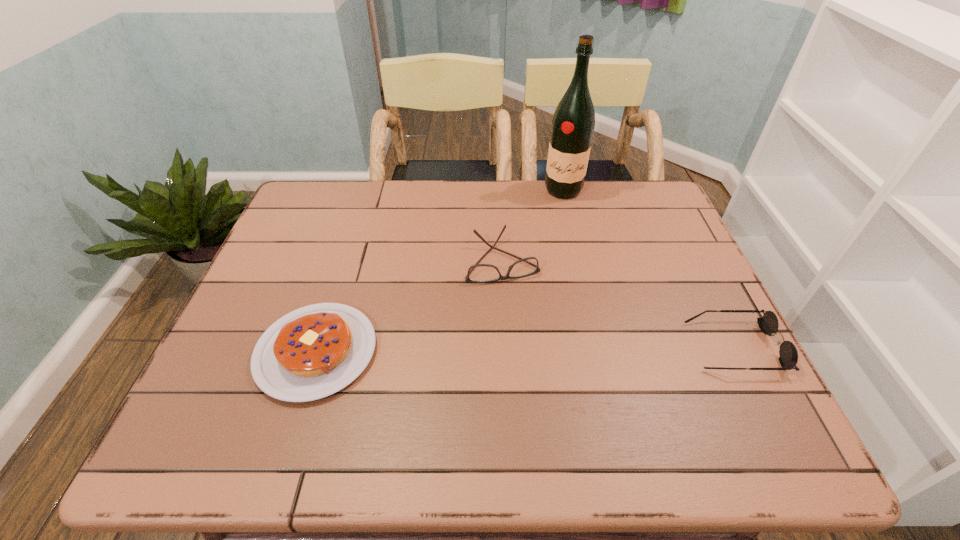
The width and height of the screenshot is (960, 540). In the image, there is a desktop. What are the coordinates of `vacant space at the far edge` in the screenshot? It's located at (355, 217).

Locate an element on the screen. The height and width of the screenshot is (540, 960). vacant space at the near edge of the desktop is located at coordinates (633, 386).

Identify the location of free region at the left edge of the desktop. This screenshot has height=540, width=960. (285, 267).

The height and width of the screenshot is (540, 960). In the image, there is a desktop. Find the location of `vacant space at the right edge`. vacant space at the right edge is located at coordinates (629, 226).

Locate an element on the screen. The height and width of the screenshot is (540, 960). free region at the far left corner of the desktop is located at coordinates (327, 215).

Find the location of a particular element. The image size is (960, 540). vacant region at the far right corner is located at coordinates (647, 193).

The width and height of the screenshot is (960, 540). Find the location of `blank region between the farthest object and the sunglasses`. blank region between the farthest object and the sunglasses is located at coordinates (648, 268).

The height and width of the screenshot is (540, 960). I want to click on vacant space that's between the rightmost object and the second object from left to right, so click(x=617, y=303).

Where is `vacant area that lies between the rightmost object and the second farthest object`? vacant area that lies between the rightmost object and the second farthest object is located at coordinates (617, 303).

Where is `free spot between the liquor and the sunglasses`? The height and width of the screenshot is (540, 960). free spot between the liquor and the sunglasses is located at coordinates (648, 268).